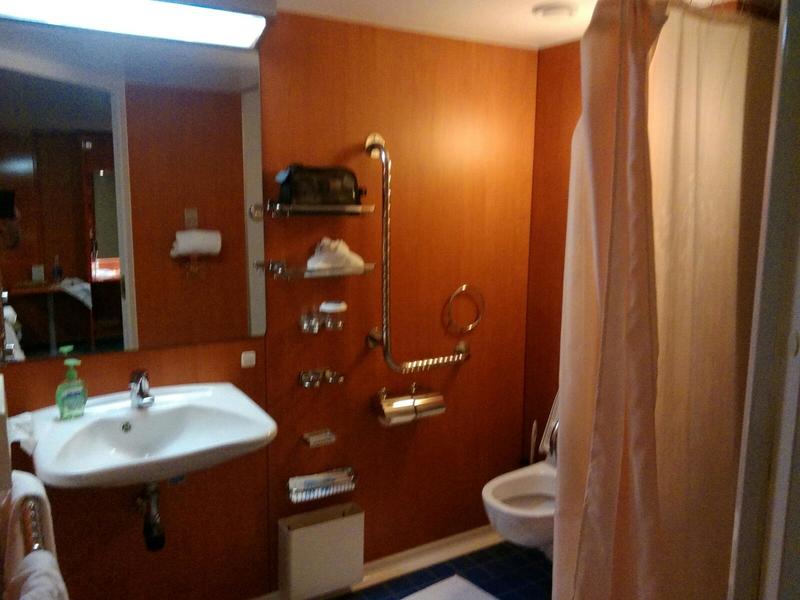
This screenshot has width=800, height=600. Identify the location of ceramic white wash basin. (210, 414).